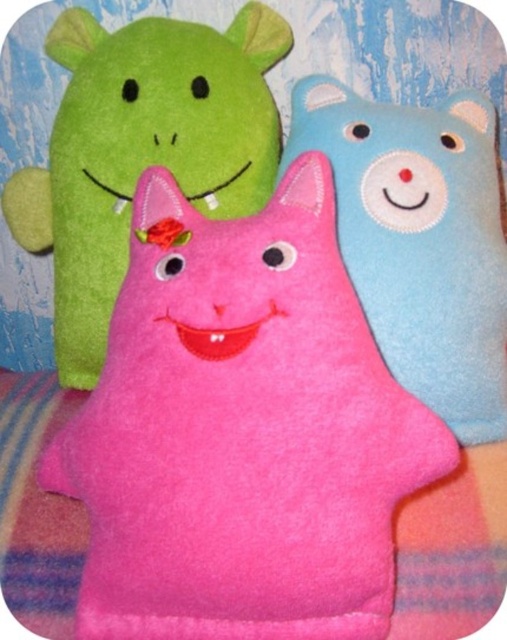
Question: Does matte pink plush at center appear on the right side of blue felt bear at upper right?

Choices:
 (A) no
 (B) yes

Answer: (A)

Question: Is pink felt cat at center smaller than blue felt bear at upper right?

Choices:
 (A) no
 (B) yes

Answer: (B)

Question: Estimate the real-world distances between objects in this image. Which object is closer to the pink felt cat at center?

Choices:
 (A) matte pink plush at center
 (B) blue felt bear at upper right

Answer: (B)

Question: Which point is farther from the camera taking this photo?

Choices:
 (A) 218,326
 (B) 402,176
 (C) 264,36

Answer: (C)

Question: Can you confirm if pink felt cat at center is positioned above matte pink plush at center?

Choices:
 (A) no
 (B) yes

Answer: (A)

Question: Among these objects, which one is farthest from the camera?

Choices:
 (A) pink felt cat at center
 (B) matte pink plush at center

Answer: (B)